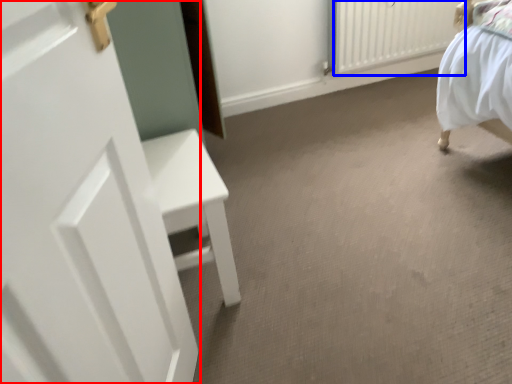
Question: Which of the following is the closest to the observer, door (highlighted by a red box) or radiator (highlighted by a blue box)?

Choices:
 (A) door
 (B) radiator

Answer: (A)